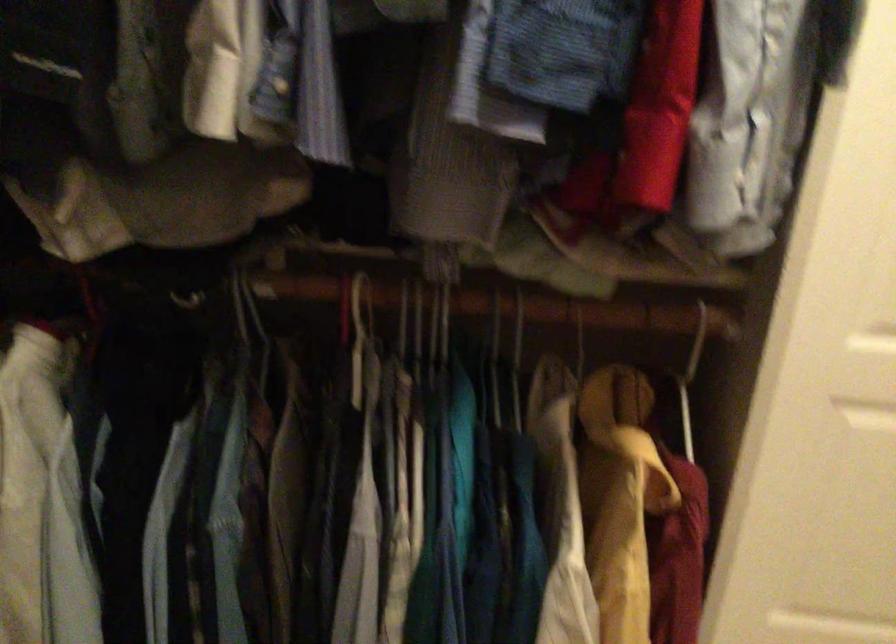
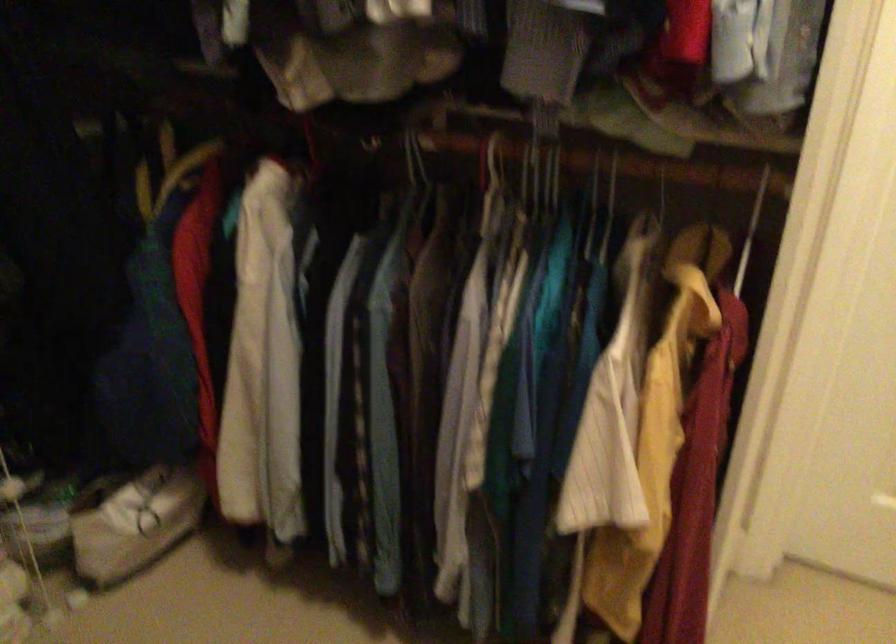
In the second image, find the point that corresponds to point 642,355 in the first image.

(751, 230)